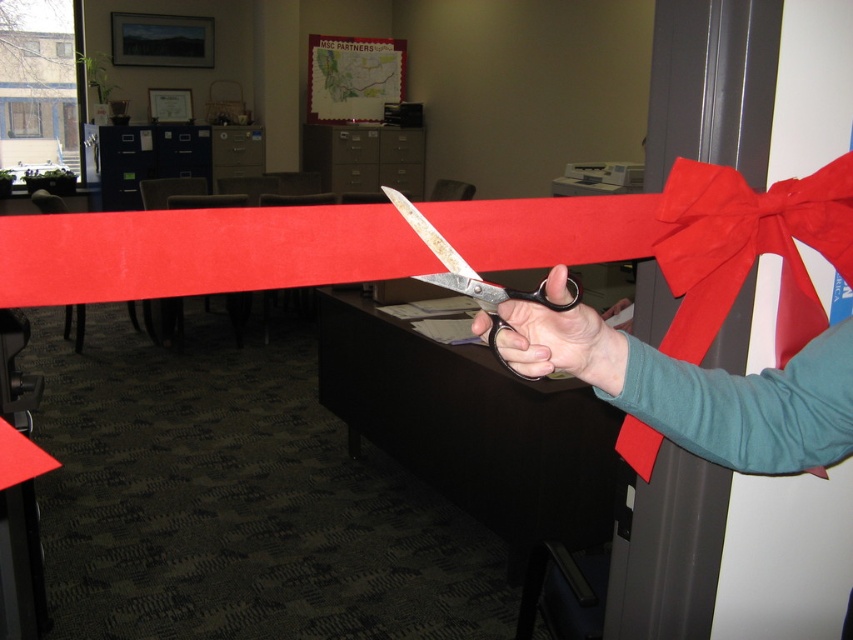
Which is behind, point (502, 317) or point (554, 269)?

The point (502, 317) is more distant.

Can you confirm if metallic scissors at center is smaller than matte black scissors at center?

Actually, metallic scissors at center might be larger than matte black scissors at center.

Between point (648, 380) and point (524, 317), which one is positioned in front?

Point (524, 317) is in front.

The width and height of the screenshot is (853, 640). Find the location of `metallic scissors at center`. metallic scissors at center is located at coordinates (699, 388).

From the picture: Can you confirm if matte black scissors at center is smaller than metallic shears at center?

Yes, matte black scissors at center is smaller than metallic shears at center.

The width and height of the screenshot is (853, 640). Find the location of `matte black scissors at center`. matte black scissors at center is located at coordinates (556, 342).

Does metallic scissors at center appear on the right side of metallic shears at center?

Indeed, metallic scissors at center is positioned on the right side of metallic shears at center.

Which is in front, point (544, 352) or point (397, 209)?

Point (544, 352) is in front.

Image resolution: width=853 pixels, height=640 pixels. Find the location of `metallic scissors at center`. metallic scissors at center is located at coordinates (699, 388).

At what (x,y) coordinates should I click in order to perform the action: click on metallic scissors at center. Please return your answer as a coordinate pair (x, y). Looking at the image, I should click on (699, 388).